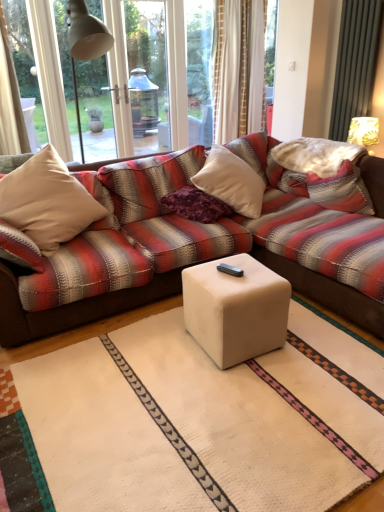
Question: Considering their positions, is purple textured pillow at center, the first pillow when ordered from left to right, located in front of or behind white fabric lampshade at upper right?

Choices:
 (A) behind
 (B) front

Answer: (B)

Question: Is purple textured pillow at center, placed as the 2th pillow when sorted from right to left, spatially inside white fabric lampshade at upper right, or outside of it?

Choices:
 (A) inside
 (B) outside

Answer: (B)

Question: Considering the real-world distances, which object is farthest from the striped fabric pillow at right, marked as the first pillow in a right-to-left arrangement?

Choices:
 (A) purple textured pillow at center, placed as the 2th pillow when sorted from right to left
 (B) beige fabric pillow at left
 (C) white matte cube at center
 (D) white fabric lampshade at upper right

Answer: (B)

Question: Based on their relative distances, which object is nearer to the beige fabric pillow at left?

Choices:
 (A) striped fabric pillow at right, positioned as the second pillow in left-to-right order
 (B) white matte cube at center
 (C) white fabric lampshade at upper right
 (D) purple textured pillow at center, the first pillow when ordered from left to right

Answer: (D)